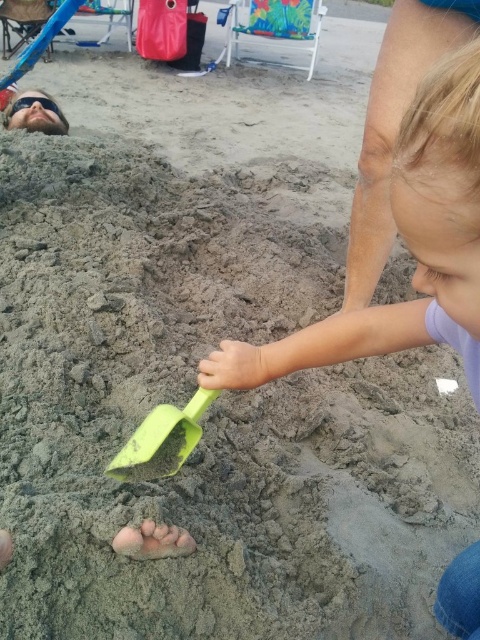
You are standing at the beach and want to know which of the two points, point (457, 292) or point (166, 467), is closer to you. Can you determine this based on the scene?

Point (457, 292) is closer to the viewer than point (166, 467).

You are a photographer trying to capture the pastel purple shirt at center in your shot. Based on the scene description, where should you position your camera to ensure the shirt is in the frame?

The pastel purple shirt at center is located at point (407, 246), so position your camera to focus on that coordinate to include the shirt in the frame.